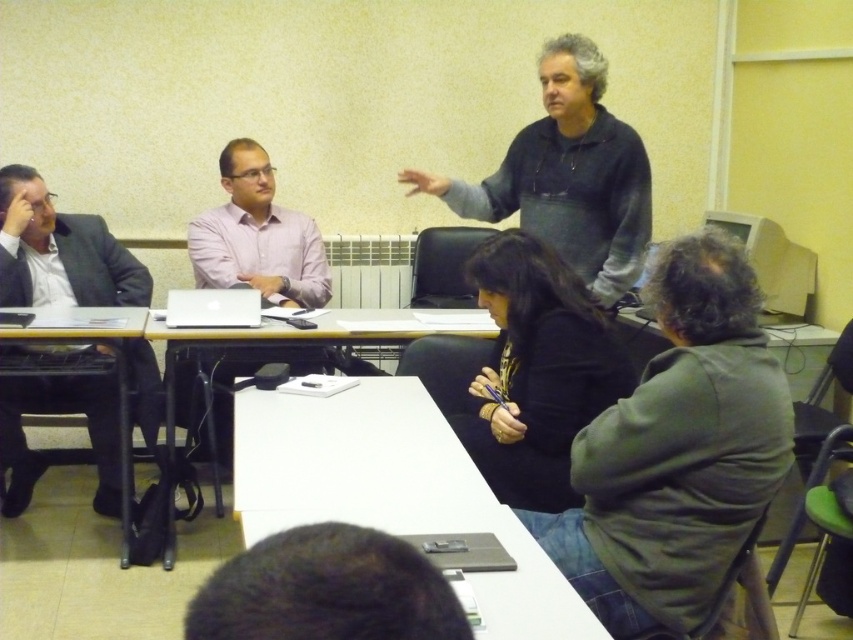
Looking at this image, which is more to the right, white glossy table at center or white matte laptop at center?

white glossy table at center is more to the right.

Consider the image. Who is shorter, white glossy table at center or white matte laptop at center?

Standing shorter between the two is white matte laptop at center.

At what (x,y) coordinates should I click in order to perform the action: click on white glossy table at center. Please return your answer as a coordinate pair (x, y). This screenshot has width=853, height=640. Looking at the image, I should click on (271, 340).

At what (x,y) coordinates should I click in order to perform the action: click on white glossy table at center. Please return your answer as a coordinate pair (x, y). Looking at the image, I should click on (271, 340).

Who is positioned more to the right, black matte jacket at lower center or dark brown hair at lower center?

Positioned to the right is black matte jacket at lower center.

Is point (523, 272) behind point (407, 563)?

Yes, point (523, 272) is behind point (407, 563).

At what (x,y) coordinates should I click in order to perform the action: click on black matte jacket at lower center. Please return your answer as a coordinate pair (x, y). This screenshot has width=853, height=640. Looking at the image, I should click on (537, 371).

Does matte black suit at left come in front of white matte laptop at center?

No.

Identify the location of matte black suit at left. This screenshot has width=853, height=640. (61, 252).

At what (x,y) coordinates should I click in order to perform the action: click on matte black suit at left. Please return your answer as a coordinate pair (x, y). This screenshot has height=640, width=853. Looking at the image, I should click on (61, 252).